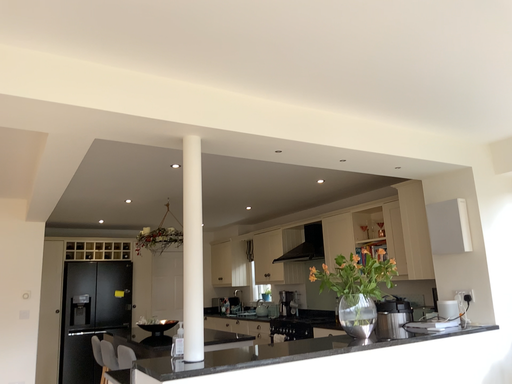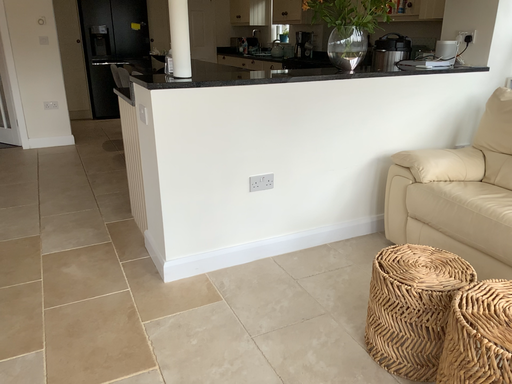
Question: Which way did the camera rotate in the video?

Choices:
 (A) rotated downward
 (B) rotated upward

Answer: (A)